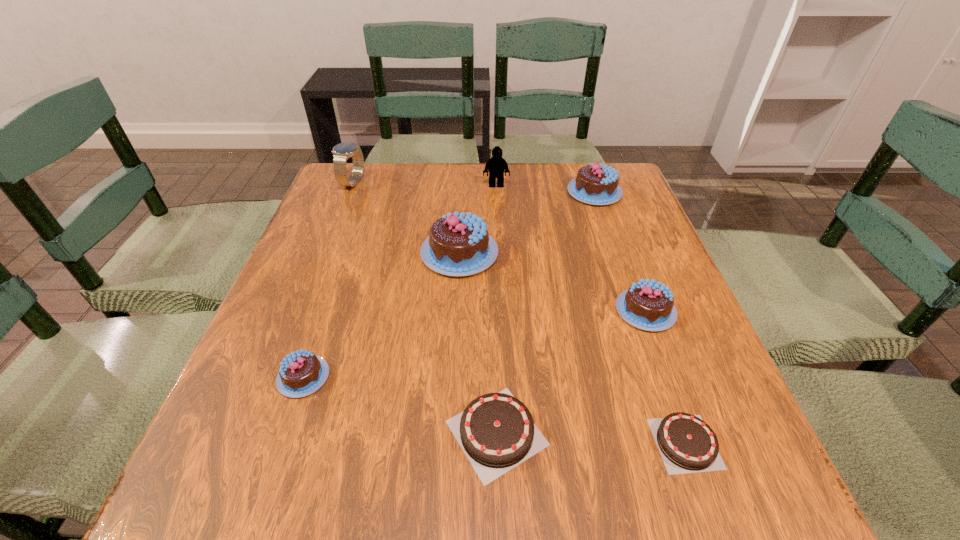
At what (x,y) coordinates should I click in order to perform the action: click on vacant space at the far edge of the desktop. Please return your answer as a coordinate pair (x, y). This screenshot has height=540, width=960. Looking at the image, I should click on (413, 185).

Find the location of `free space at the near edge of the desktop`. free space at the near edge of the desktop is located at coordinates (497, 493).

At what (x,y) coordinates should I click in order to perform the action: click on free space at the left edge of the desktop. Please return your answer as a coordinate pair (x, y). This screenshot has width=960, height=540. Looking at the image, I should click on (265, 414).

The height and width of the screenshot is (540, 960). Find the location of `vacant space at the right edge of the desktop`. vacant space at the right edge of the desktop is located at coordinates (619, 324).

Where is `blank space at the far right corner of the desktop`? blank space at the far right corner of the desktop is located at coordinates (627, 202).

The image size is (960, 540). What are the coordinates of `unoccupied position between the second biggest pink chocolate cake and the black Lego` in the screenshot? It's located at (545, 189).

Image resolution: width=960 pixels, height=540 pixels. What are the coordinates of `free spot between the watch and the right brown chocolate cake` in the screenshot? It's located at (519, 313).

Find the location of `vacant space that is in between the third shortest chocolate cake and the second shortest chocolate cake`. vacant space that is in between the third shortest chocolate cake and the second shortest chocolate cake is located at coordinates (400, 405).

Locate an element on the screen. vacant area between the fourth nearest object and the second farthest pink chocolate cake is located at coordinates tap(552, 282).

Find the location of a particular element. The image size is (960, 540). blank region between the third shortest chocolate cake and the Lego is located at coordinates (399, 281).